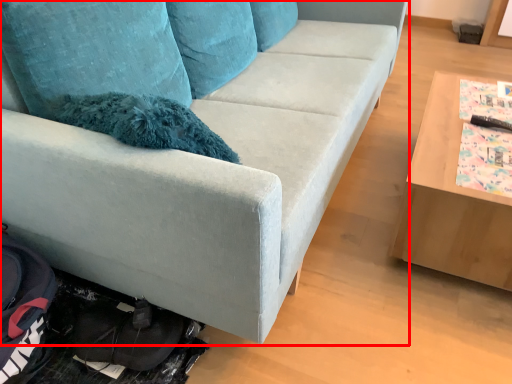
Question: Observing the image, what is the correct spatial positioning of studio couch (annotated by the red box) in reference to table?

Choices:
 (A) left
 (B) right

Answer: (A)